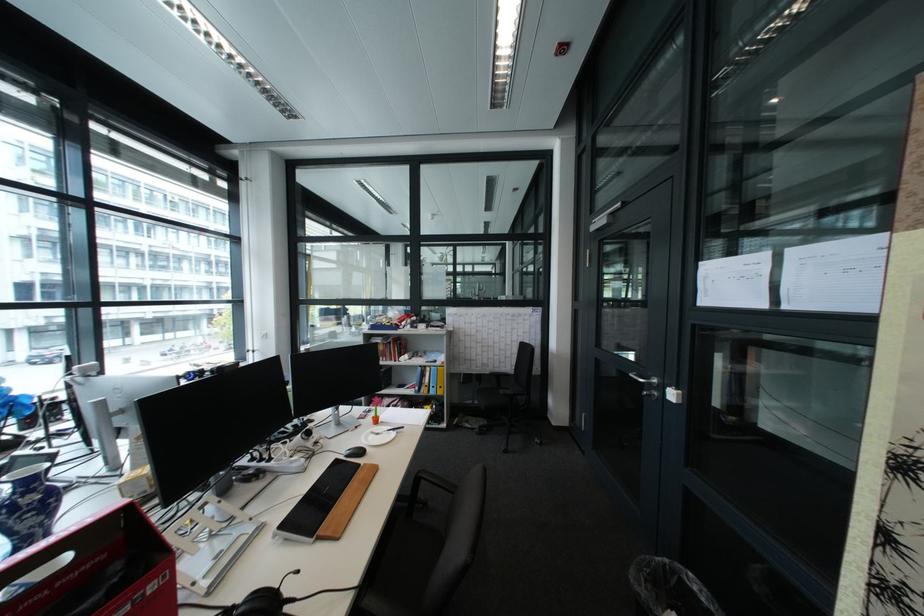
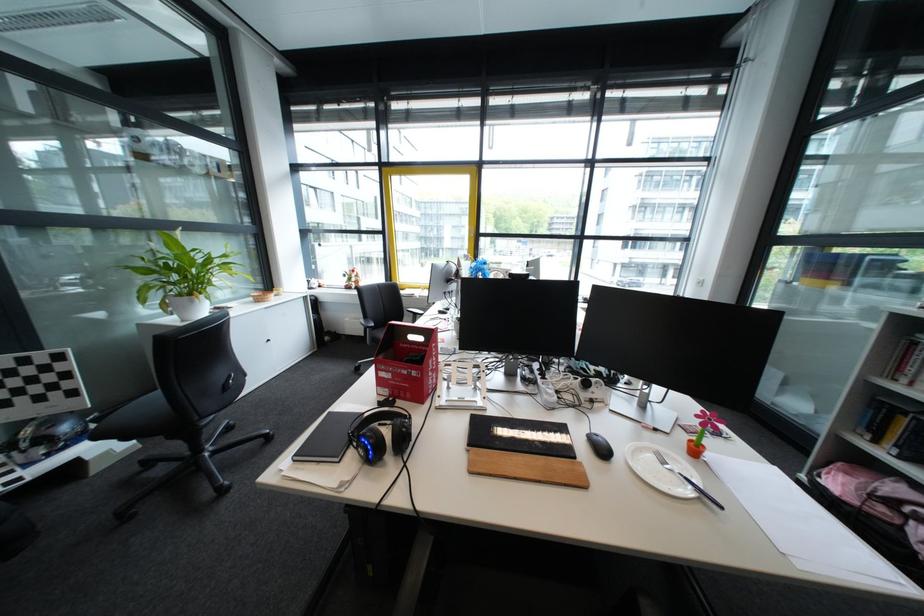
Locate, in the second image, the point that corresponds to point (325, 537) in the first image.

(481, 446)